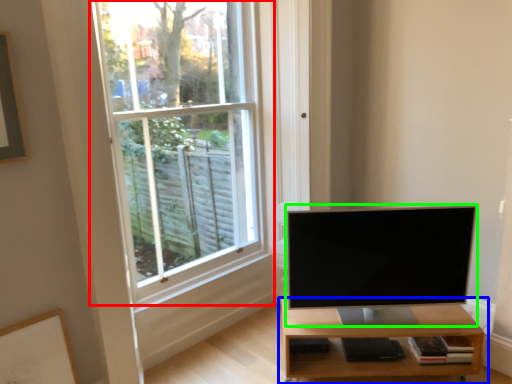
Question: Which object is the closest to the window (highlighted by a red box)? Choose among these: shelf (highlighted by a blue box) or television (highlighted by a green box).

Choices:
 (A) shelf
 (B) television

Answer: (B)